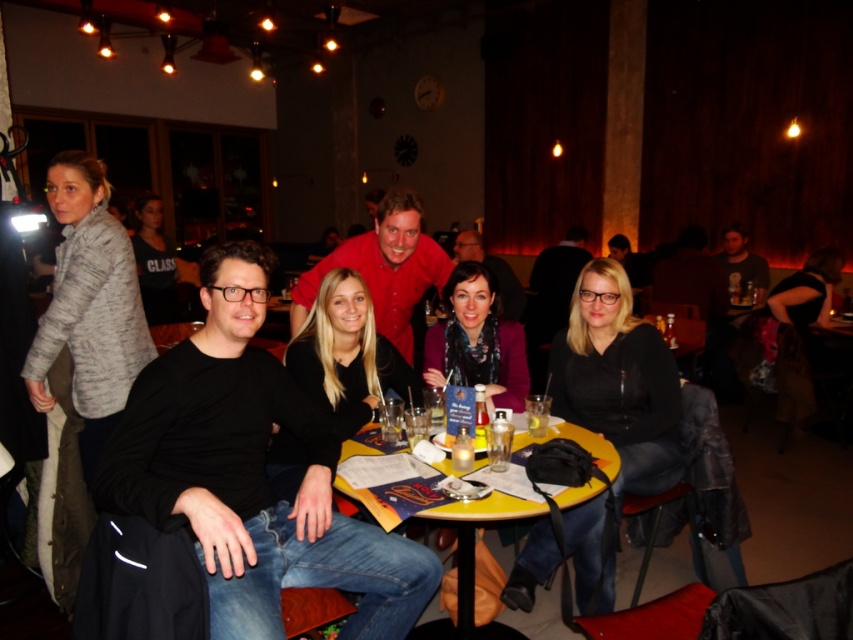
Question: Among these objects, which one is nearest to the camera?

Choices:
 (A) yellowwoodentable at center
 (B) clear plastic cup at table center

Answer: (A)

Question: Which point is farther to the camera?

Choices:
 (A) (431, 515)
 (B) (527, 429)

Answer: (B)

Question: Is yellowwoodentable at center in front of clear plastic cup at table center?

Choices:
 (A) yes
 (B) no

Answer: (A)

Question: Is yellowwoodentable at center further to the viewer compared to clear plastic cup at table center?

Choices:
 (A) yes
 (B) no

Answer: (B)

Question: Can you confirm if yellowwoodentable at center is thinner than clear plastic cup at table center?

Choices:
 (A) yes
 (B) no

Answer: (B)